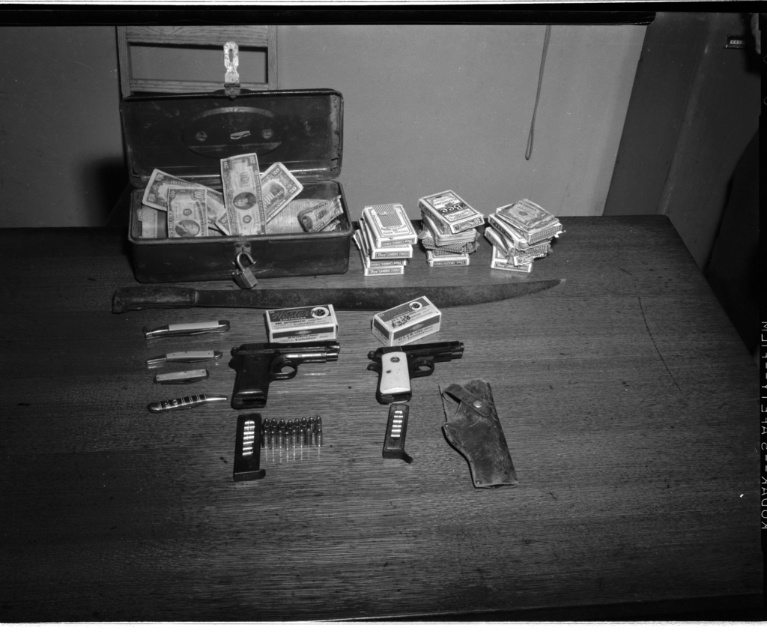
Question: Which point appears farthest from the camera in this image?

Choices:
 (A) (407, 358)
 (B) (245, 356)
 (C) (262, 132)

Answer: (C)

Question: Can you confirm if metallic suitcase at upper center is bigger than polished silver handgun at center?

Choices:
 (A) no
 (B) yes

Answer: (B)

Question: Which object is the farthest from the metallic suitcase at upper center?

Choices:
 (A) wooden table at center
 (B) polished silver handgun at center

Answer: (B)

Question: Which of these objects is positioned farthest from the metallic suitcase at upper center?

Choices:
 (A) wooden table at center
 (B) polished silver handgun at center
 (C) polished metal handgun at center

Answer: (B)

Question: Does wooden table at center have a smaller size compared to metallic suitcase at upper center?

Choices:
 (A) no
 (B) yes

Answer: (A)

Question: In this image, where is wooden table at center located relative to polished silver handgun at center?

Choices:
 (A) right
 (B) left

Answer: (B)